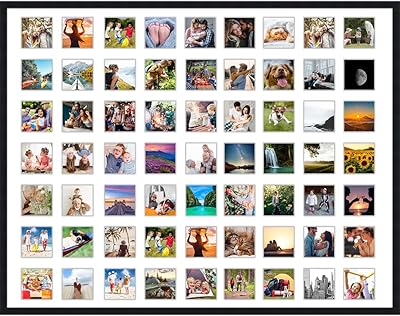
Where is `individual pictures on the bottom row`? individual pictures on the bottom row is located at coordinates (30, 282), (85, 283), (121, 286), (164, 280), (204, 279), (235, 279), (281, 281), (323, 282), (362, 281).